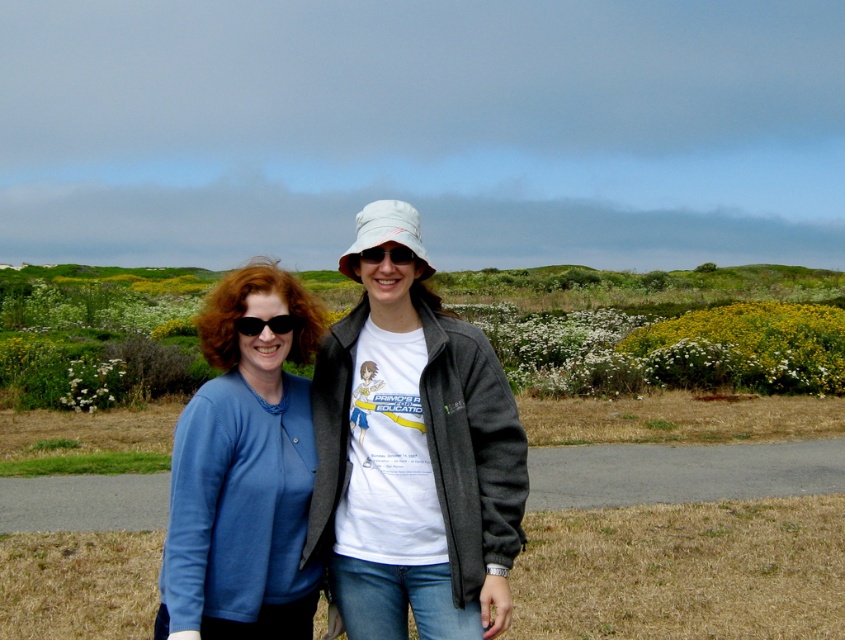
Which is more to the left, matte blue cardigan at left or white fabric baseball hat at center?

white fabric baseball hat at center is more to the left.

Who is taller, matte blue cardigan at left or white fabric baseball hat at center?

With more height is white fabric baseball hat at center.

Find the location of a particular element. This screenshot has width=845, height=640. matte blue cardigan at left is located at coordinates (243, 472).

Who is higher up, white fabric baseball hat at center or matte white hat at center?

white fabric baseball hat at center is higher up.

Does white fabric baseball hat at center appear on the right side of matte white hat at center?

No, white fabric baseball hat at center is not to the right of matte white hat at center.

The image size is (845, 640). I want to click on white fabric baseball hat at center, so click(x=385, y=232).

Which is above, white fabric baseball hat at center or black plastic sunglasses at center?

Positioned higher is white fabric baseball hat at center.

Can you confirm if white fabric baseball hat at center is positioned to the right of black plastic sunglasses at center?

In fact, white fabric baseball hat at center is to the left of black plastic sunglasses at center.

Between point (342, 264) and point (243, 320), which one is positioned behind?

The point (342, 264) is more distant.

Find the location of a particular element. The image size is (845, 640). white fabric baseball hat at center is located at coordinates (385, 232).